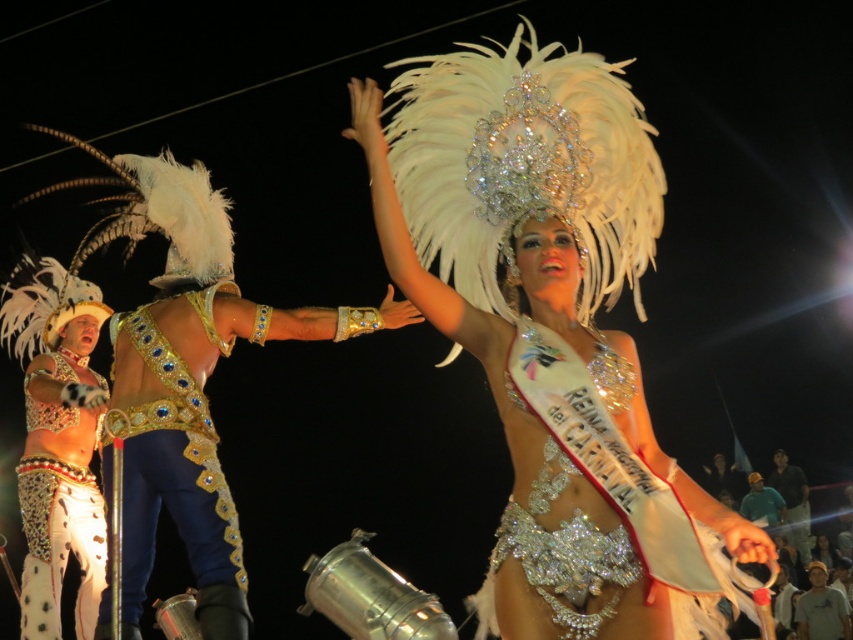
Consider the image. You are a photographer at the carnival trying to capture the Carnival Queen and her companion. You notice the white feathered headdress at upper center and the gold sequined belt at center. Which object is positioned higher in the image?

The white feathered headdress at upper center is positioned higher than the gold sequined belt at center.